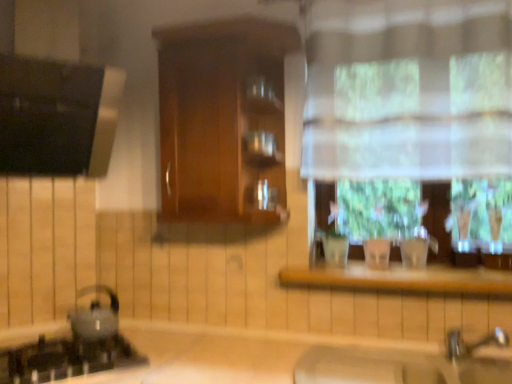
Question: From the image's perspective, is shiny metallic kettle at lower left on top of black glass gas stove at lower left?

Choices:
 (A) yes
 (B) no

Answer: (A)

Question: Is shiny metallic kettle at lower left next to black glass gas stove at lower left and touching it?

Choices:
 (A) no
 (B) yes

Answer: (A)

Question: Does shiny metallic kettle at lower left have a greater width compared to black glass gas stove at lower left?

Choices:
 (A) no
 (B) yes

Answer: (A)

Question: From a real-world perspective, is shiny metallic kettle at lower left over black glass gas stove at lower left?

Choices:
 (A) no
 (B) yes

Answer: (B)

Question: Is shiny metallic kettle at lower left positioned behind black glass gas stove at lower left?

Choices:
 (A) no
 (B) yes

Answer: (B)

Question: From a real-world perspective, is shiny metallic kettle at lower left above or below white sheer curtain at upper right?

Choices:
 (A) above
 (B) below

Answer: (B)

Question: Visually, is shiny metallic kettle at lower left positioned to the left or to the right of white sheer curtain at upper right?

Choices:
 (A) right
 (B) left

Answer: (B)

Question: Based on their sizes in the image, would you say shiny metallic kettle at lower left is bigger or smaller than white sheer curtain at upper right?

Choices:
 (A) big
 (B) small

Answer: (B)

Question: Relative to white sheer curtain at upper right, is shiny metallic kettle at lower left in front or behind?

Choices:
 (A) front
 (B) behind

Answer: (B)

Question: In the image, is beige matte sink at lower center on the left side or the right side of shiny metallic kettle at lower left?

Choices:
 (A) left
 (B) right

Answer: (B)

Question: Based on their sizes in the image, would you say beige matte sink at lower center is bigger or smaller than shiny metallic kettle at lower left?

Choices:
 (A) small
 (B) big

Answer: (B)

Question: Considering their positions, is beige matte sink at lower center located in front of or behind shiny metallic kettle at lower left?

Choices:
 (A) front
 (B) behind

Answer: (A)

Question: In terms of width, does beige matte sink at lower center look wider or thinner when compared to shiny metallic kettle at lower left?

Choices:
 (A) wide
 (B) thin

Answer: (A)

Question: Considering the positions of black glass gas stove at lower left and wooden at center in the image, is black glass gas stove at lower left wider or thinner than wooden at center?

Choices:
 (A) wide
 (B) thin

Answer: (A)

Question: Based on their sizes in the image, would you say black glass gas stove at lower left is bigger or smaller than wooden at center?

Choices:
 (A) small
 (B) big

Answer: (A)